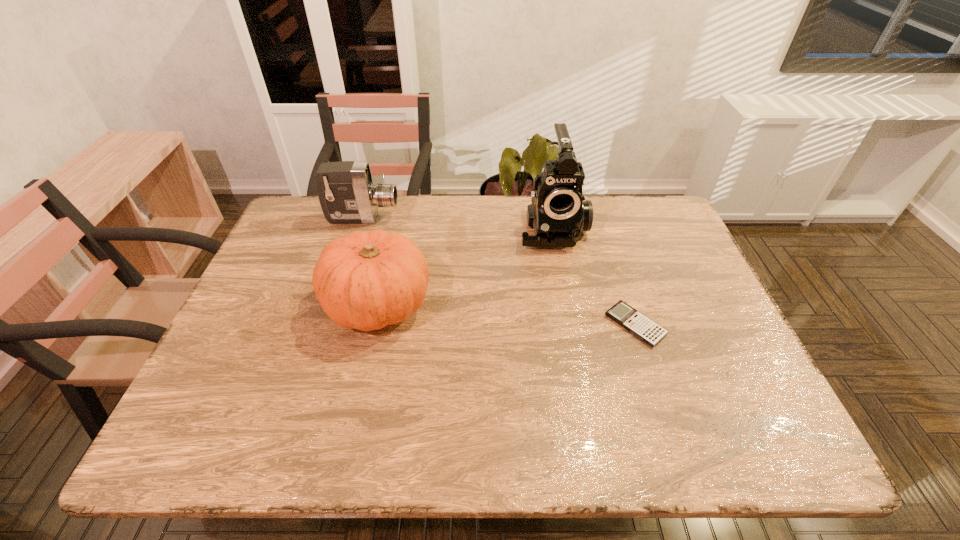
The height and width of the screenshot is (540, 960). I want to click on the taller camcorder, so click(558, 213).

Locate an element on the screen. The image size is (960, 540). the tallest object is located at coordinates (558, 213).

You are a GUI agent. You are given a task and a screenshot of the screen. Output one action in this format:
    pyautogui.click(x=<x>, y=<y>)
    Task: Click on the left camcorder
    The height and width of the screenshot is (540, 960).
    Given the screenshot: What is the action you would take?
    pyautogui.click(x=346, y=193)

Where is `pumpkin`? pumpkin is located at coordinates (366, 281).

I want to click on the shortest object, so click(x=648, y=331).

What are the coordinates of `vacant space located on the lens mount of the tallest object` in the screenshot? It's located at (573, 336).

Locate an element on the screen. The width and height of the screenshot is (960, 540). free spot located at the front of the left camcorder, highlighting the lens is located at coordinates (466, 218).

The image size is (960, 540). Find the location of `vacant position located 0.280m on the back of the pumpkin`. vacant position located 0.280m on the back of the pumpkin is located at coordinates (399, 207).

Find the location of a particular element. The image size is (960, 540). free location located 0.370m on the left of the shortest object is located at coordinates (453, 325).

This screenshot has height=540, width=960. In order to click on object situated at the left edge in this screenshot , I will do `click(346, 193)`.